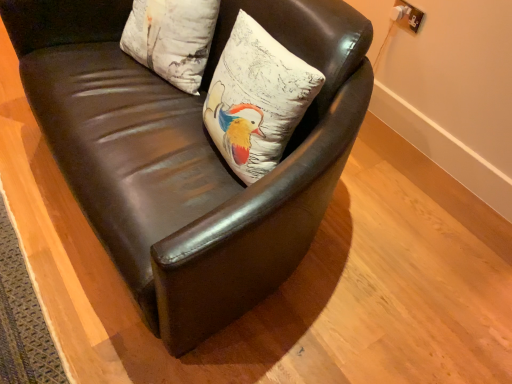
Question: Which direction should I rotate to look at white matte pillow at center, which is the 2th pillow in left-to-right order, — up or down?

Choices:
 (A) down
 (B) up

Answer: (B)

Question: Is brown leather chair at center outside white matte pillow at center, which is the 2th pillow in left-to-right order?

Choices:
 (A) no
 (B) yes

Answer: (B)

Question: Does brown leather chair at center appear on the left side of white matte pillow at center, the 1th pillow viewed from the right?

Choices:
 (A) yes
 (B) no

Answer: (A)

Question: Can you confirm if brown leather chair at center is smaller than white matte pillow at center, the 1th pillow viewed from the right?

Choices:
 (A) yes
 (B) no

Answer: (B)

Question: Can you confirm if brown leather chair at center is shorter than white matte pillow at center, the 1th pillow viewed from the right?

Choices:
 (A) no
 (B) yes

Answer: (A)

Question: Is brown leather chair at center positioned behind white matte pillow at center, the 1th pillow viewed from the right?

Choices:
 (A) yes
 (B) no

Answer: (B)

Question: From a real-world perspective, is brown leather chair at center physically below white matte pillow at center, the 1th pillow viewed from the right?

Choices:
 (A) no
 (B) yes

Answer: (B)

Question: Can you confirm if brown leather chair at center is thinner than white textured pillow at upper center, placed as the first pillow when sorted from left to right?

Choices:
 (A) yes
 (B) no

Answer: (B)

Question: From a real-world perspective, is brown leather chair at center below white textured pillow at upper center, placed as the first pillow when sorted from left to right?

Choices:
 (A) yes
 (B) no

Answer: (A)

Question: From a real-world perspective, does brown leather chair at center stand above white textured pillow at upper center, placed as the first pillow when sorted from left to right?

Choices:
 (A) yes
 (B) no

Answer: (B)

Question: Is brown leather chair at center at the left side of white textured pillow at upper center, marked as the 2th pillow in a right-to-left arrangement?

Choices:
 (A) no
 (B) yes

Answer: (A)

Question: Is brown leather chair at center to the right of white textured pillow at upper center, placed as the first pillow when sorted from left to right, from the viewer's perspective?

Choices:
 (A) no
 (B) yes

Answer: (B)

Question: Considering the relative sizes of brown leather chair at center and white textured pillow at upper center, placed as the first pillow when sorted from left to right, in the image provided, is brown leather chair at center smaller than white textured pillow at upper center, placed as the first pillow when sorted from left to right,?

Choices:
 (A) no
 (B) yes

Answer: (A)

Question: Is white textured pillow at upper center, placed as the first pillow when sorted from left to right, at the right side of brown leather chair at center?

Choices:
 (A) yes
 (B) no

Answer: (B)